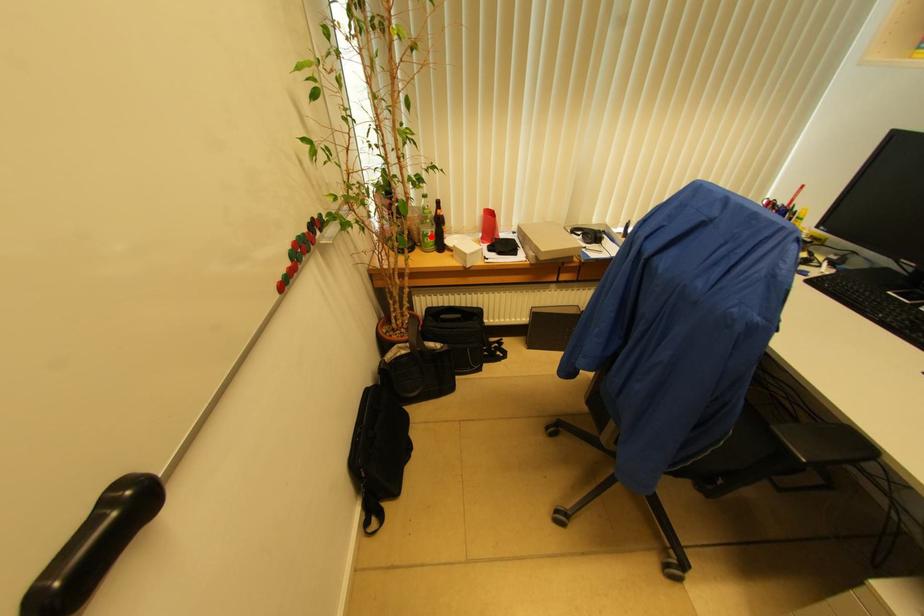
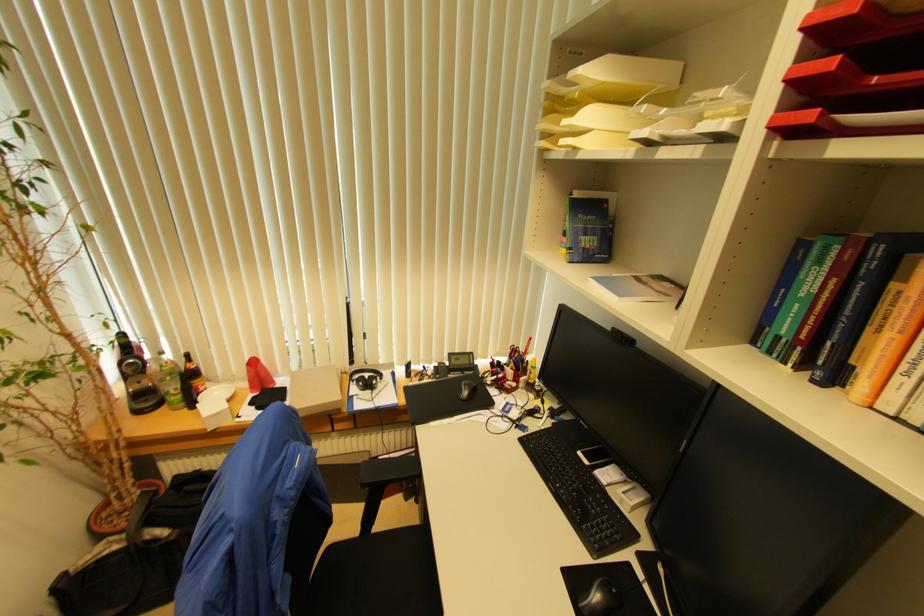
Question: I am providing you with two images of the same scene from different viewpoints. A red point is shown in image1. For the corresponding object point in image2, is it positioned nearer or farther from the camera?

Choices:
 (A) Nearer
 (B) Farther

Answer: (B)